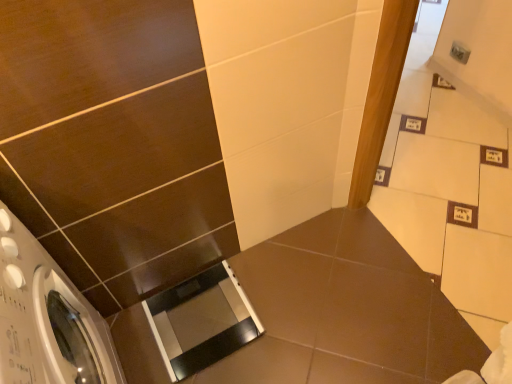
Question: Looking at their shapes, would you say white glossy washing machine at lower left is wider or thinner than transparent plastic screen door at lower center?

Choices:
 (A) wide
 (B) thin

Answer: (A)

Question: In terms of height, does white glossy washing machine at lower left look taller or shorter compared to transparent plastic screen door at lower center?

Choices:
 (A) short
 (B) tall

Answer: (B)

Question: Which is farther from the white glossy washing machine at lower left?

Choices:
 (A) transparent plastic screen door at lower center
 (B) black glossy scale at lower center

Answer: (B)

Question: Which of these objects is positioned closest to the black glossy scale at lower center?

Choices:
 (A) transparent plastic screen door at lower center
 (B) white glossy washing machine at lower left

Answer: (A)